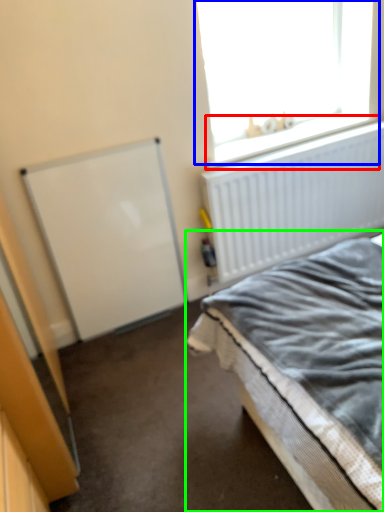
Question: Which is farther away from window sill (highlighted by a red box)? window (highlighted by a blue box) or bed (highlighted by a green box)?

Choices:
 (A) window
 (B) bed

Answer: (B)